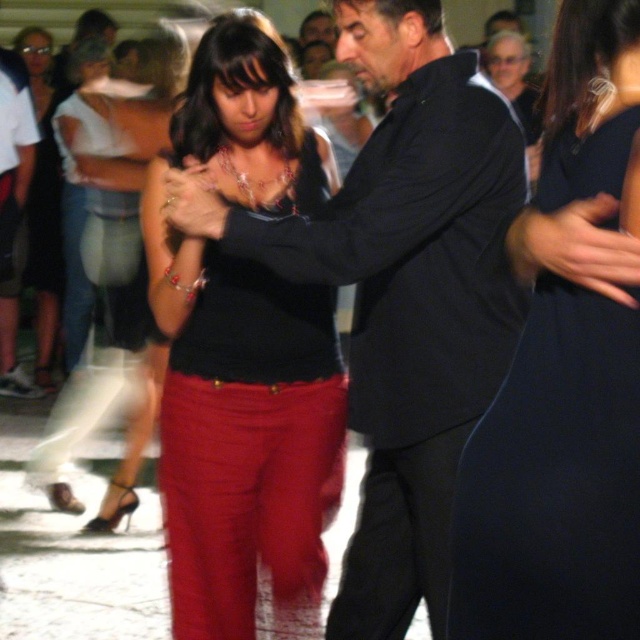
Does black satin dress at center have a larger size compared to black smooth pants at center?

Yes, black satin dress at center is bigger than black smooth pants at center.

Can you confirm if black satin dress at center is positioned below black smooth pants at center?

No, black satin dress at center is not below black smooth pants at center.

You are a GUI agent. You are given a task and a screenshot of the screen. Output one action in this format:
    pyautogui.click(x=<x>, y=<y>)
    Task: Click on the black satin dress at center
    The width and height of the screenshot is (640, 640).
    Given the screenshot: What is the action you would take?
    554,481

Where is `black satin dress at center`? This screenshot has width=640, height=640. black satin dress at center is located at coordinates (554, 481).

Can you confirm if matte black top at center is bigger than black satin dress at center?

Indeed, matte black top at center has a larger size compared to black satin dress at center.

Measure the distance between matte black top at center and camera.

matte black top at center and camera are 1.95 meters apart from each other.

This screenshot has height=640, width=640. Identify the location of matte black top at center. (243, 348).

How distant is black smooth pants at center from matte black top at upper left?

black smooth pants at center and matte black top at upper left are 4.07 meters apart.

Does black smooth pants at center have a lesser height compared to matte black top at upper left?

Correct, black smooth pants at center is not as tall as matte black top at upper left.

This screenshot has height=640, width=640. Describe the element at coordinates (400, 540) in the screenshot. I see `black smooth pants at center` at that location.

What are the coordinates of `black smooth pants at center` in the screenshot? It's located at (400, 540).